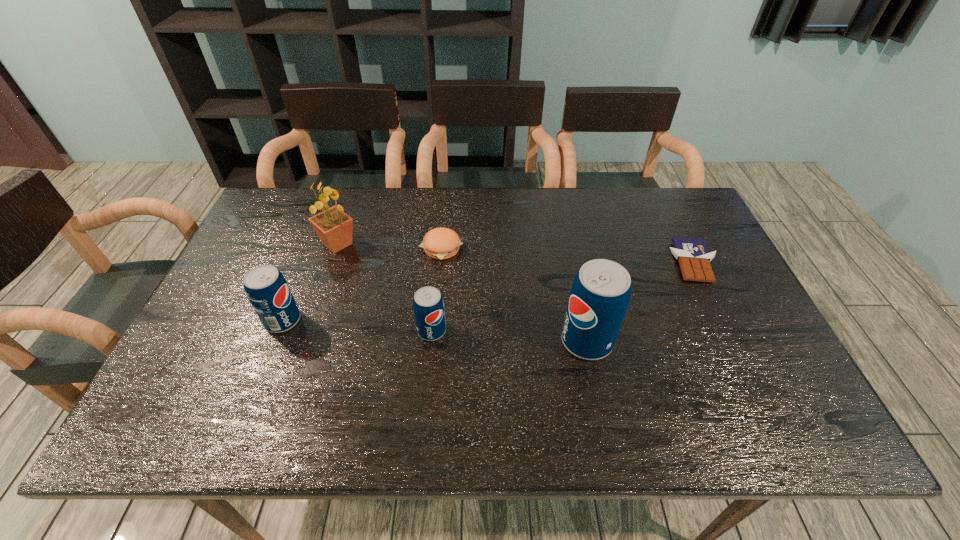
Locate an element on the screen. blank space that satisfies the following two spatial constraints: 1. at the front of the second shortest object with flowers visible; 2. on the right side of the sunflower is located at coordinates (336, 248).

Identify the location of vacant area in the image that satisfies the following two spatial constraints: 1. on the front side of the leftmost pop; 2. on the left side of the rightmost pop. The width and height of the screenshot is (960, 540). (275, 341).

Image resolution: width=960 pixels, height=540 pixels. Find the location of `free space that satisfies the following two spatial constraints: 1. on the back side of the fifth tallest object; 2. at the front of the sunflower with flowers visible`. free space that satisfies the following two spatial constraints: 1. on the back side of the fifth tallest object; 2. at the front of the sunflower with flowers visible is located at coordinates (442, 244).

Where is `free space that satisfies the following two spatial constraints: 1. on the back side of the chocolate bar; 2. on the right side of the second pop from right to left`? free space that satisfies the following two spatial constraints: 1. on the back side of the chocolate bar; 2. on the right side of the second pop from right to left is located at coordinates (438, 262).

At what (x,y) coordinates should I click in order to perform the action: click on blank space that satisfies the following two spatial constraints: 1. at the front of the sunflower with flowers visible; 2. on the back side of the fifth tallest object. Please return your answer as a coordinate pair (x, y). The width and height of the screenshot is (960, 540). Looking at the image, I should click on (336, 248).